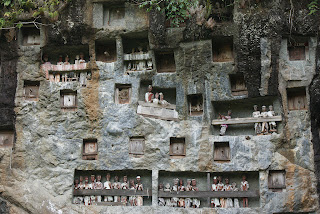
The height and width of the screenshot is (214, 320). What are the coordinates of `dirt on wall` in the screenshot? It's located at (x=89, y=89), (x=303, y=172).